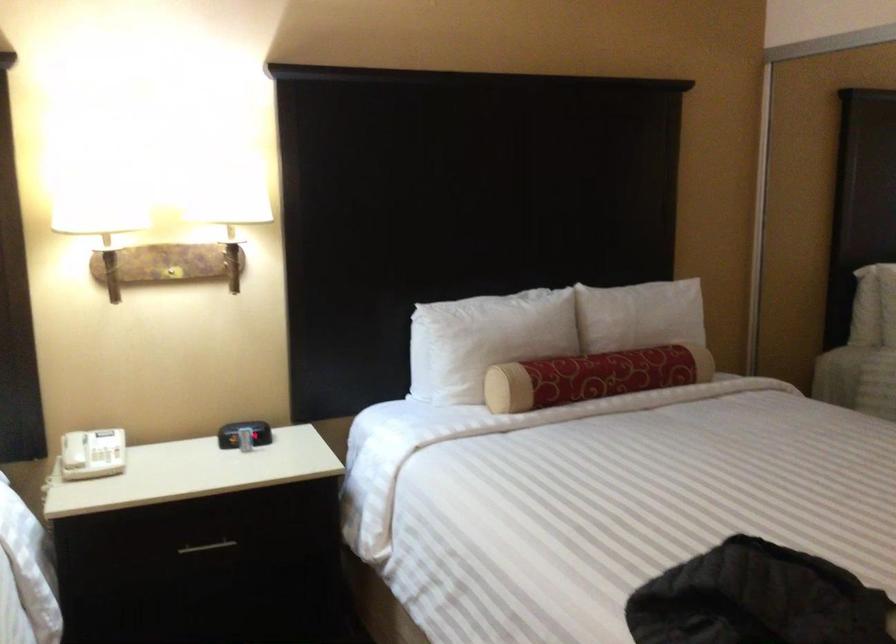
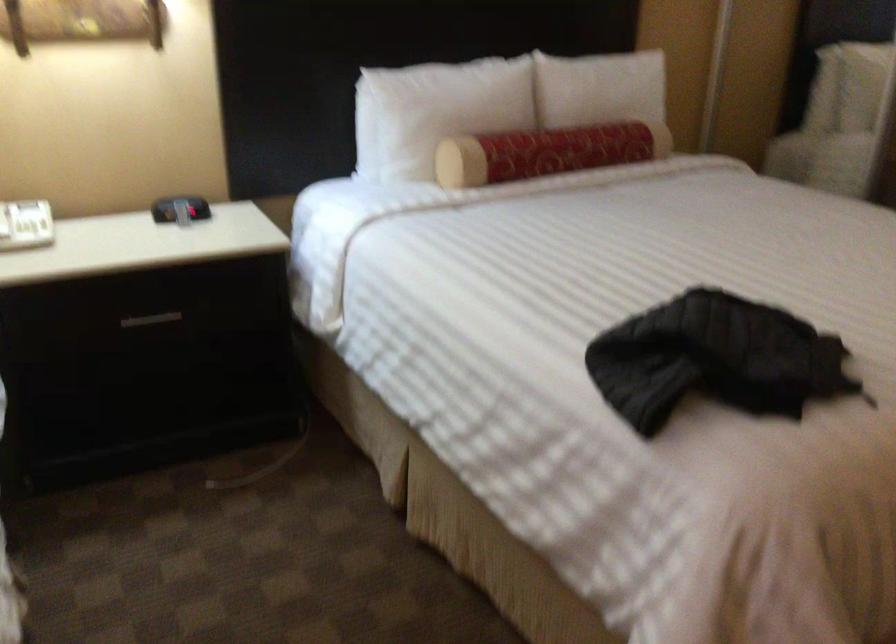
The point at (202, 545) is marked in the first image. Where is the corresponding point in the second image?

(151, 319)